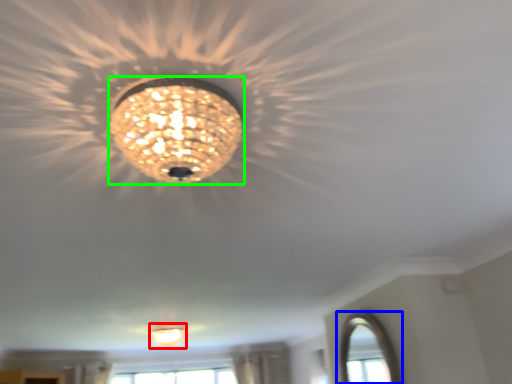
Question: Which object is positioned farthest from lamp (highlighted by a red box)? Select from window (highlighted by a blue box) and lamp (highlighted by a green box).

Choices:
 (A) window
 (B) lamp

Answer: (B)